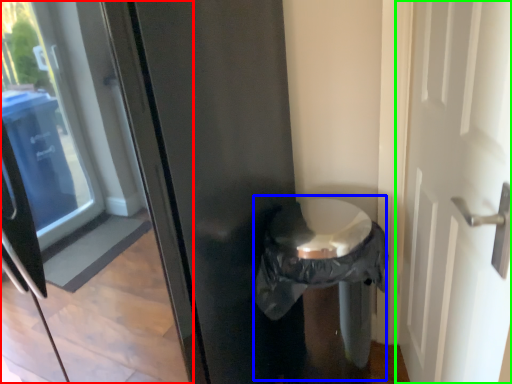
Question: Which object is positioned farthest from glass door (highlighted by a red box)? Select from garbage (highlighted by a blue box) and door (highlighted by a green box).

Choices:
 (A) garbage
 (B) door

Answer: (B)